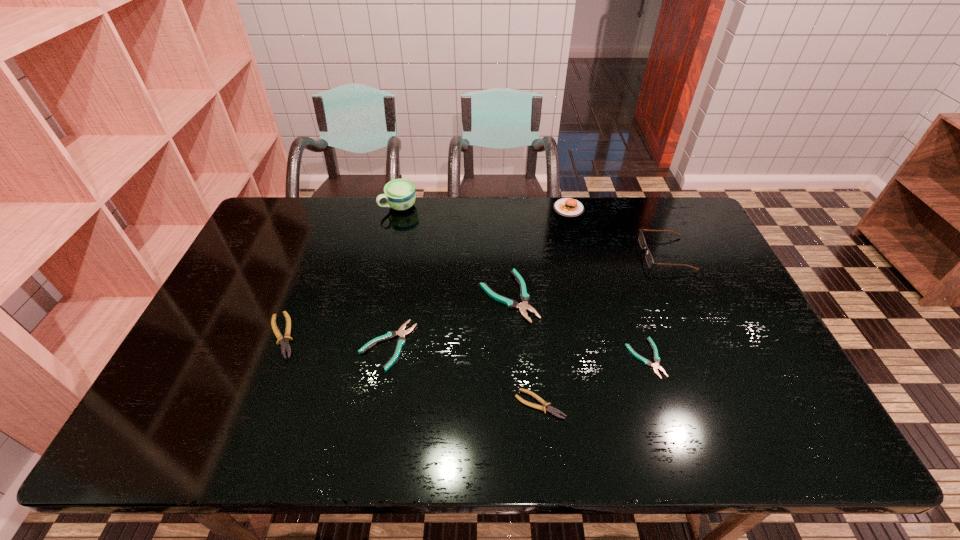
Identify the location of blue cup. This screenshot has width=960, height=540. (400, 195).

Image resolution: width=960 pixels, height=540 pixels. What are the coordinates of `cup` in the screenshot? It's located at (400, 195).

The image size is (960, 540). What are the coordinates of `spectacles` in the screenshot? It's located at (649, 259).

Locate an element on the screen. The width and height of the screenshot is (960, 540). food is located at coordinates (567, 207).

The width and height of the screenshot is (960, 540). Find the location of `the biggest teal pliers`. the biggest teal pliers is located at coordinates (524, 297).

You are a GUI agent. You are given a task and a screenshot of the screen. Output one action in this format:
    pyautogui.click(x=<x>, y=<y>)
    Task: Click on the leftmost object
    
    Given the screenshot: What is the action you would take?
    pyautogui.click(x=285, y=345)

I want to click on the bigger yellow pliers, so click(x=285, y=345).

Where is `the second pliers from left to right`? This screenshot has width=960, height=540. the second pliers from left to right is located at coordinates click(x=401, y=332).

This screenshot has height=540, width=960. I want to click on the leftmost teal pliers, so click(x=401, y=332).

This screenshot has width=960, height=540. Find the location of `the nearer yellow pliers`. the nearer yellow pliers is located at coordinates (549, 409).